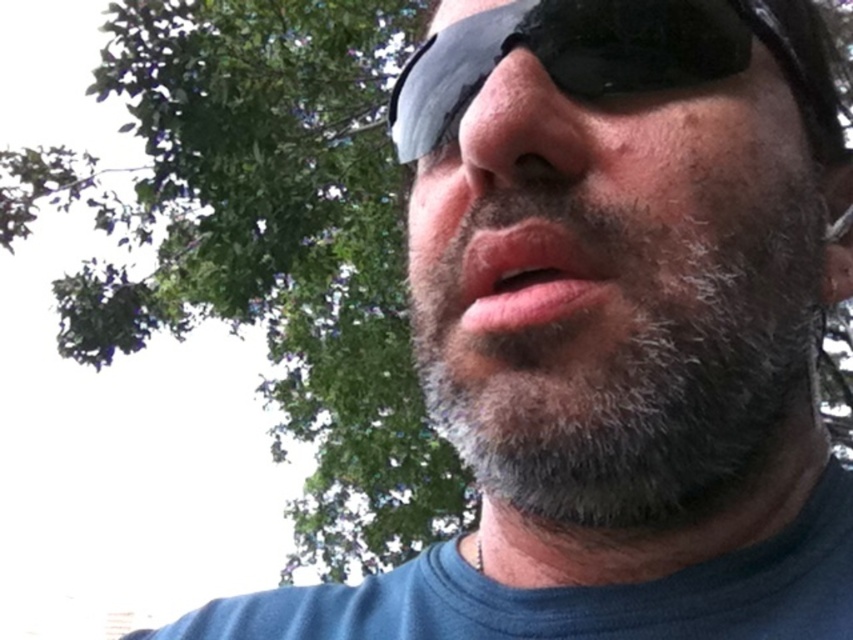
You are a photographer adjusting the focus of your camera. You want to ensure both the gray fuzzy beard at center and the black matte sunglasses at center are in focus. Which object should you focus on first to achieve this?

You should focus on the gray fuzzy beard at center first because it is in front of the black matte sunglasses at center. By focusing on the closer object, the depth of field will extend backward, potentially keeping both in focus.

You are a makeup artist trying to apply lipstick to the person in the image. Since the black matte sunglasses at center and the pink matte lips at center are both at the center, which one is closer to your left side when facing the person?

The pink matte lips at center are closer to your left side because the black matte sunglasses at center is positioned to the right of the pink matte lips at center.

You are a photographer adjusting the focus of your camera. You want to ensure that the black matte sunglasses at center are in sharp focus. Given their 2D coordinates, what is the exact point you should aim the camera at?

The exact point to aim the camera at is the 2D coordinates of the black matte sunglasses at center, which is at point [570,54].